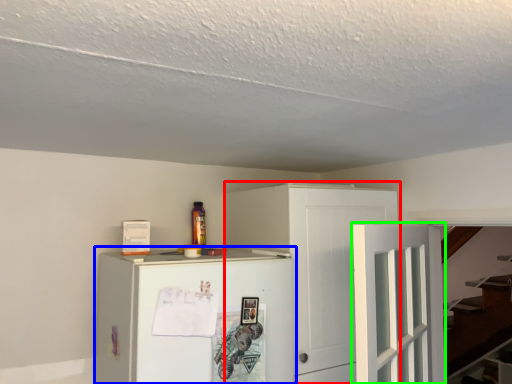
Question: Which is farther away from cabinetry (highlighted by a red box)? refrigerator (highlighted by a blue box) or door (highlighted by a green box)?

Choices:
 (A) refrigerator
 (B) door

Answer: (B)